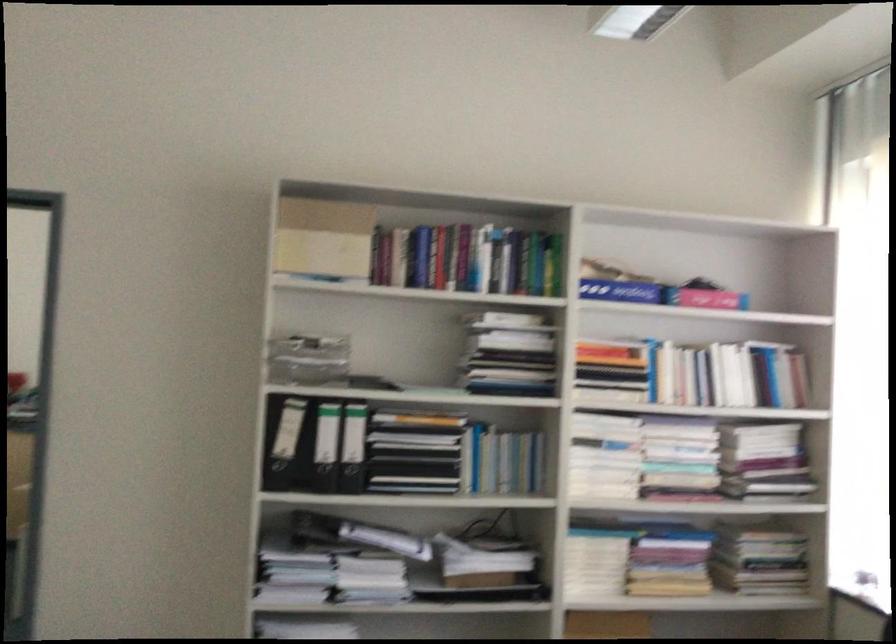
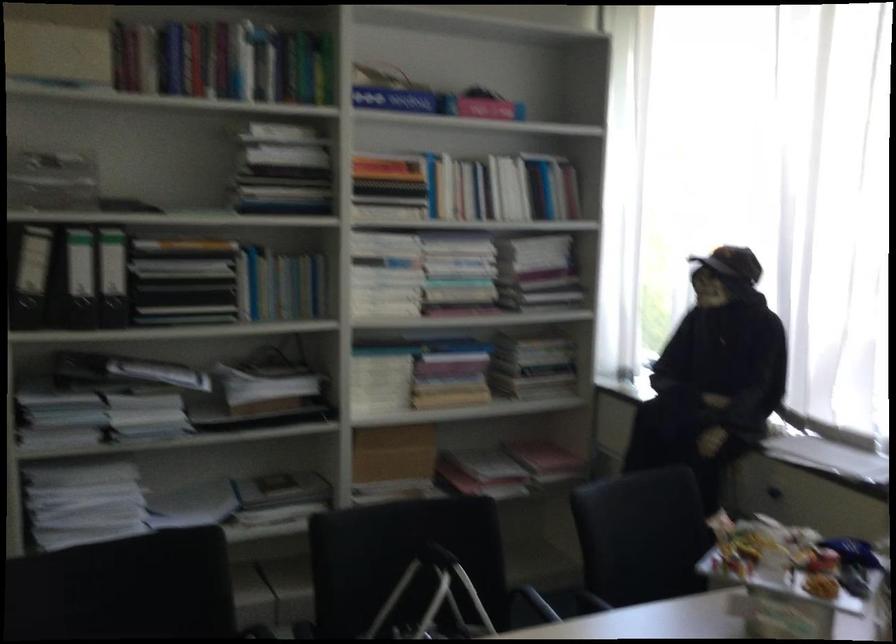
Find the pixel in the second image that matches point 660,565 in the first image.

(442, 374)